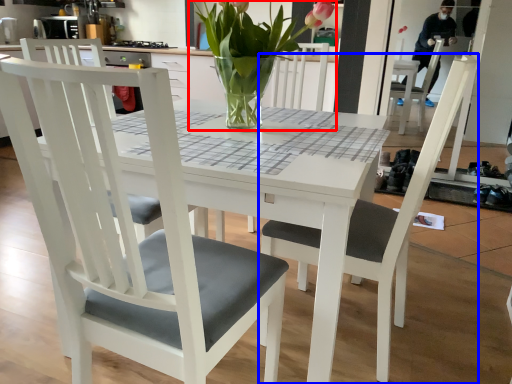
Question: Which object appears closest to the camera in this image, houseplant (highlighted by a red box) or chair (highlighted by a blue box)?

Choices:
 (A) houseplant
 (B) chair

Answer: (B)